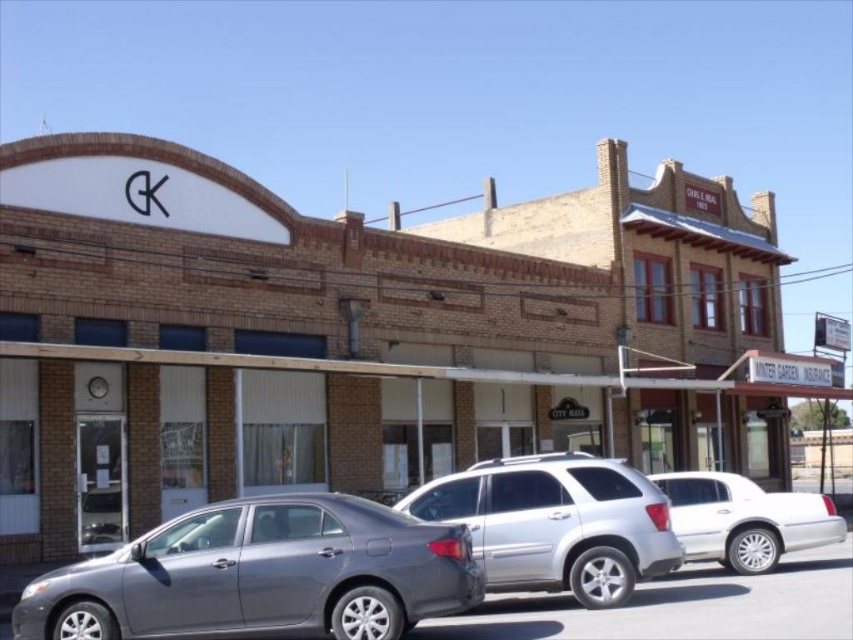
Question: Observing the image, what is the correct spatial positioning of satin silver sedan at center in reference to silver metallic suv at center?

Choices:
 (A) right
 (B) left

Answer: (B)

Question: Does silver metallic suv at center come behind white metallic sedan at right?

Choices:
 (A) yes
 (B) no

Answer: (B)

Question: Which point is closer to the camera?

Choices:
 (A) (502, 563)
 (B) (722, 531)
 (C) (24, 589)

Answer: (A)

Question: Is satin silver sedan at center positioned at the back of silver metallic suv at center?

Choices:
 (A) no
 (B) yes

Answer: (A)

Question: Which is farther from the white metallic sedan at right?

Choices:
 (A) satin silver sedan at center
 (B) silver metallic suv at center

Answer: (A)

Question: Among these points, which one is nearest to the camera?

Choices:
 (A) (706, 544)
 (B) (285, 572)

Answer: (B)